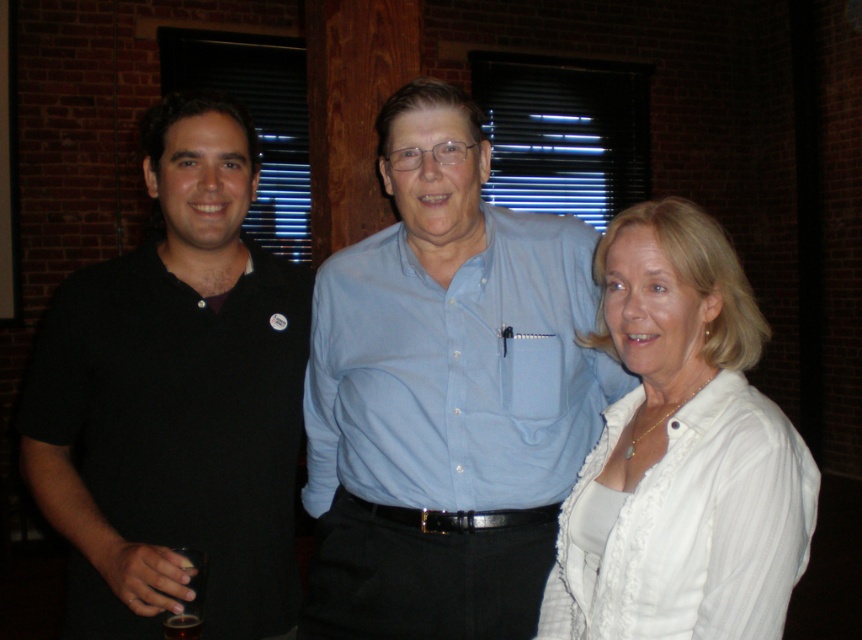
Does black matte shirt at left have a lesser height compared to light blue button-up shirt at center?

Incorrect, black matte shirt at left's height does not fall short of light blue button-up shirt at center's.

Between point (173, 365) and point (454, 340), which one is positioned behind?

The point (173, 365) is more distant.

Locate an element on the screen. Image resolution: width=862 pixels, height=640 pixels. black matte shirt at left is located at coordinates (175, 397).

Is point (250, 465) behind point (608, 333)?

Yes, it is behind point (608, 333).

Which of these two, black matte shirt at left or white lace shirt at center, stands shorter?

white lace shirt at center is shorter.

Is point (273, 516) positioned behind point (759, 488)?

Yes, it is behind point (759, 488).

The height and width of the screenshot is (640, 862). I want to click on black matte shirt at left, so click(x=175, y=397).

Identify the location of white lace shirt at center. Image resolution: width=862 pixels, height=640 pixels. (681, 452).

In the scene shown: Does white lace shirt at center lie behind light blue button-up shirt at center?

No, it is in front of light blue button-up shirt at center.

Is point (795, 582) positioned after point (478, 472)?

Yes, point (795, 582) is behind point (478, 472).

This screenshot has height=640, width=862. Identify the location of white lace shirt at center. (681, 452).